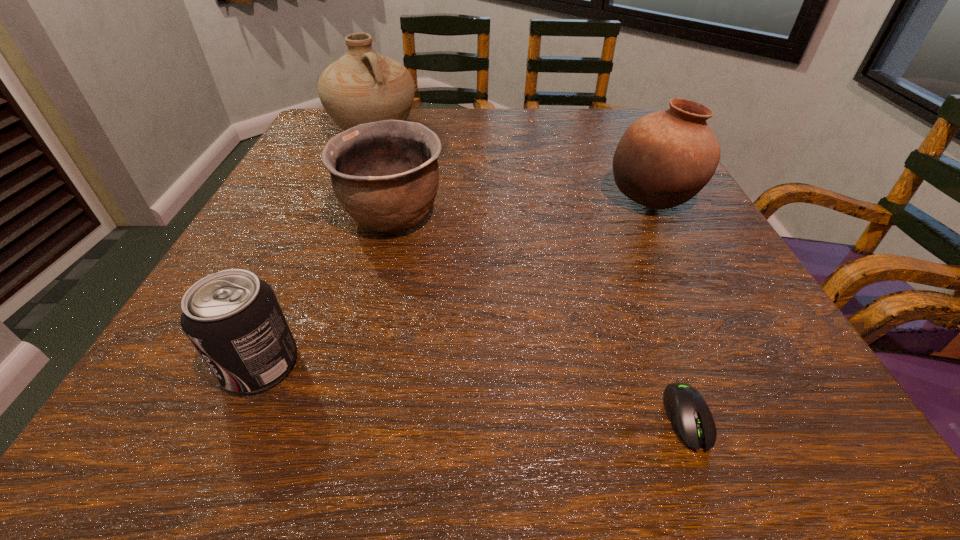
Identify the location of blank space that satisfies the following two spatial constraints: 1. on the front side of the shortest pottery; 2. on the right side of the farthest pottery. The image size is (960, 540). (339, 218).